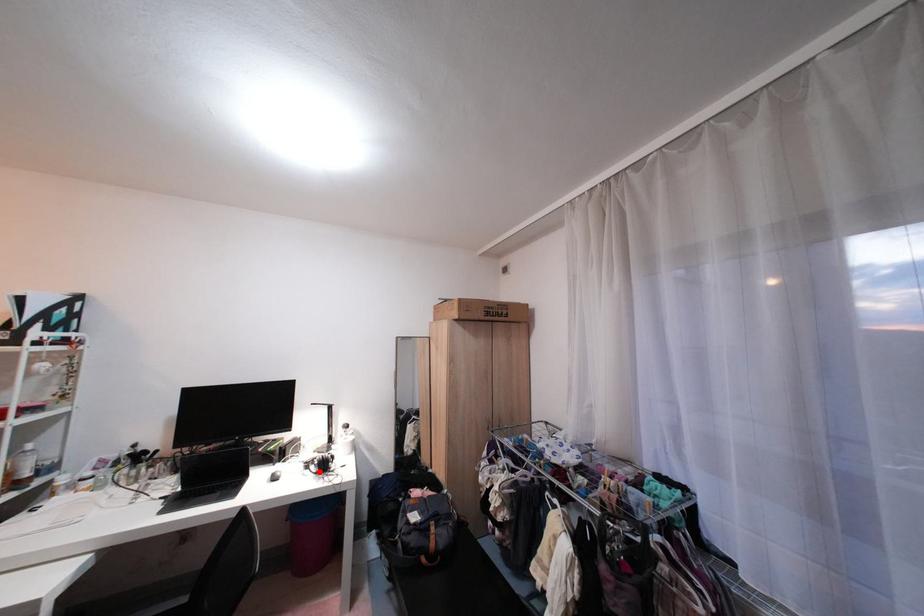
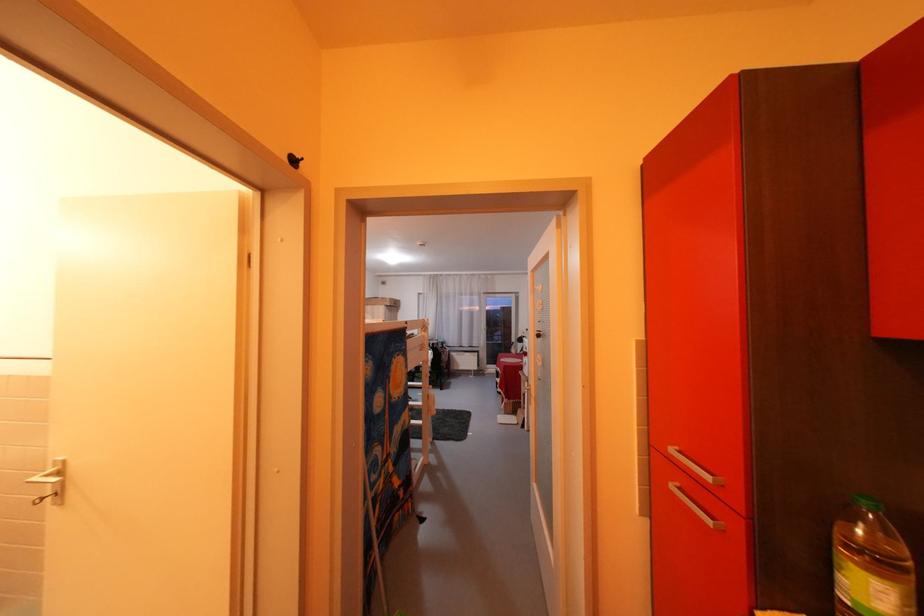
Question: I am providing you with two images of the same scene from different viewpoints. A red point is marked on the first image. Is the red point's position out of view in image 2?

Choices:
 (A) Yes
 (B) No

Answer: (A)